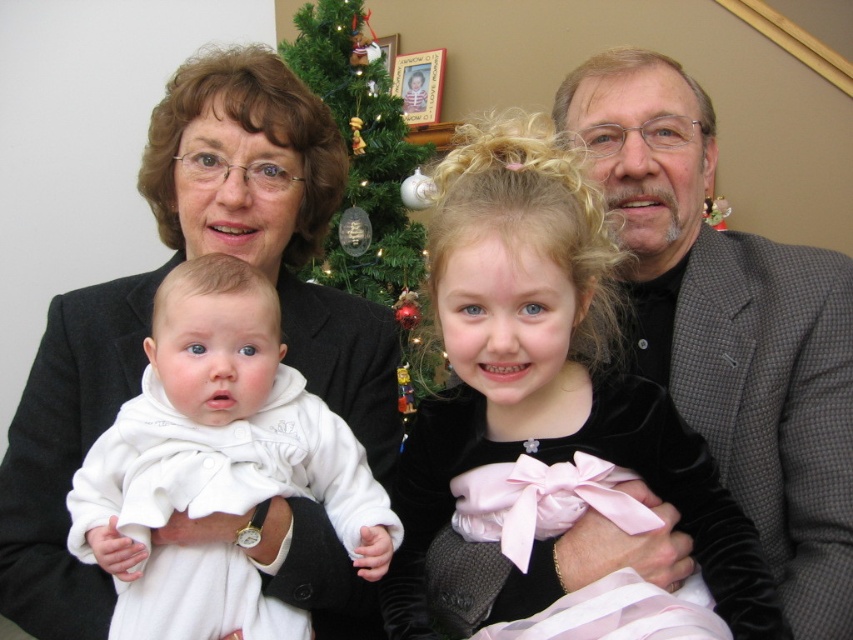
You are a photographer setting up for a family portrait. You need to position a spotlight so it illuminates both the gray textured suit at right and the velvet black dress at center without casting shadows on the tree. Given their heights, which object should the spotlight be angled towards first?

The gray textured suit at right is taller than the velvet black dress at center, so the spotlight should first be angled towards the gray textured suit at right to ensure proper illumination without casting shadows on the tree.